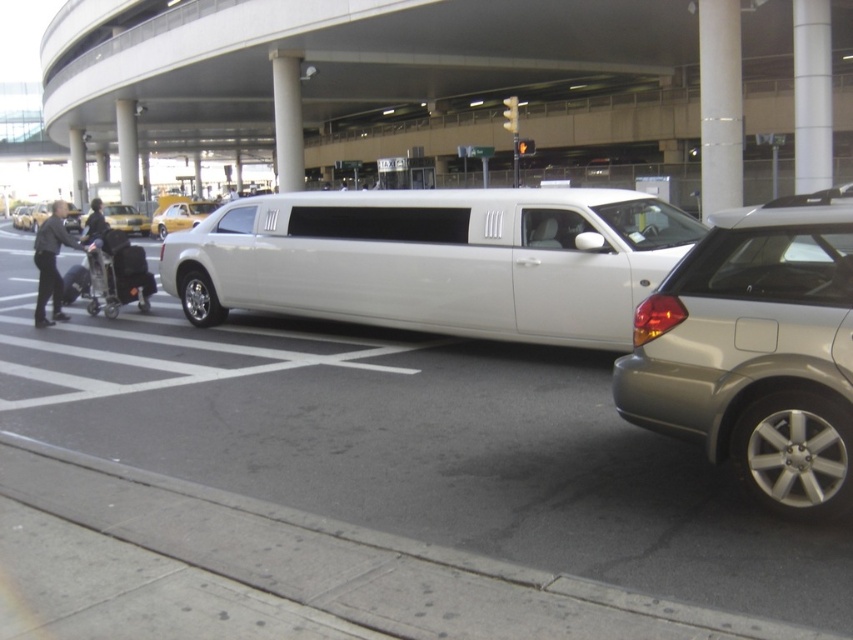
You are at an airport terminal and need to park your car. You see a satin silver minivan at right and a yellow rubber taxi at upper left. Which parking spot should you choose if you have a compact car?

The satin silver minivan at right has a lesser width compared to yellow rubber taxi at upper left, so you should choose the parking spot where the satin silver minivan at right is parked because it is designed for compact cars.